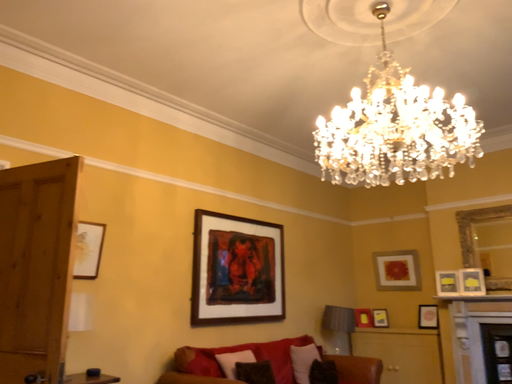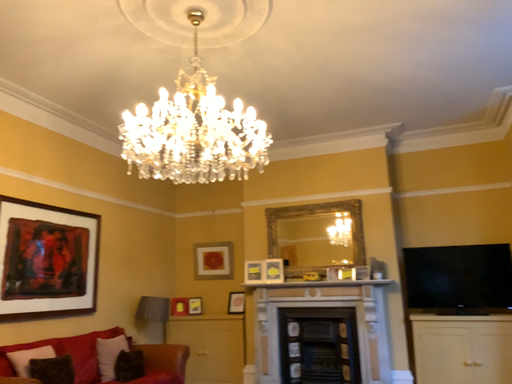
Question: Which way did the camera rotate in the video?

Choices:
 (A) rotated left
 (B) rotated right

Answer: (B)